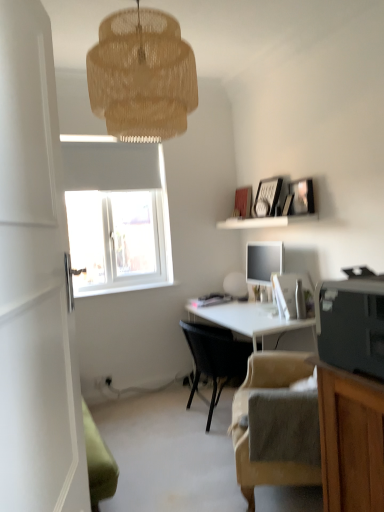
The width and height of the screenshot is (384, 512). What are the coordinates of `vacant space underneath woven beige lampshade at upper center (from a real-world perspective)` in the screenshot? It's located at (169, 494).